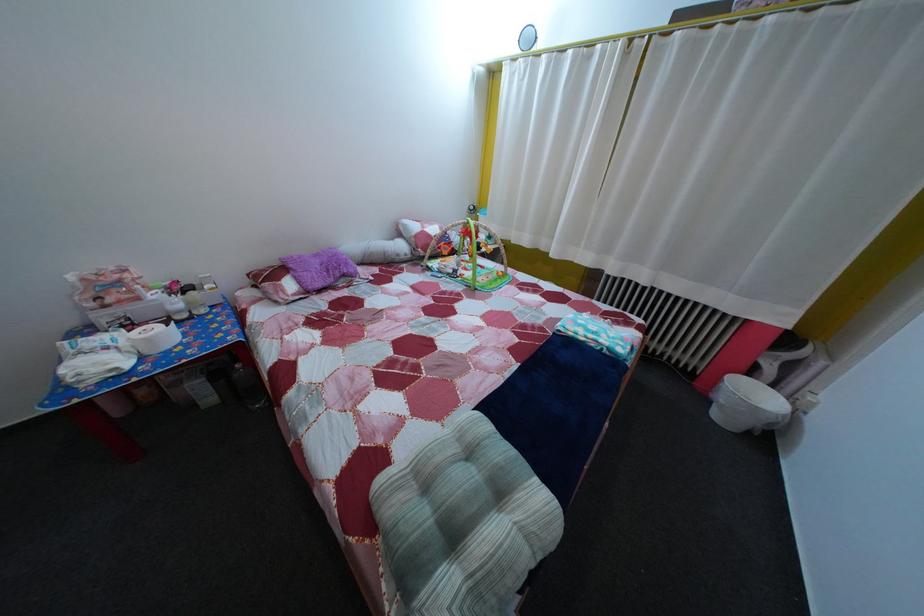
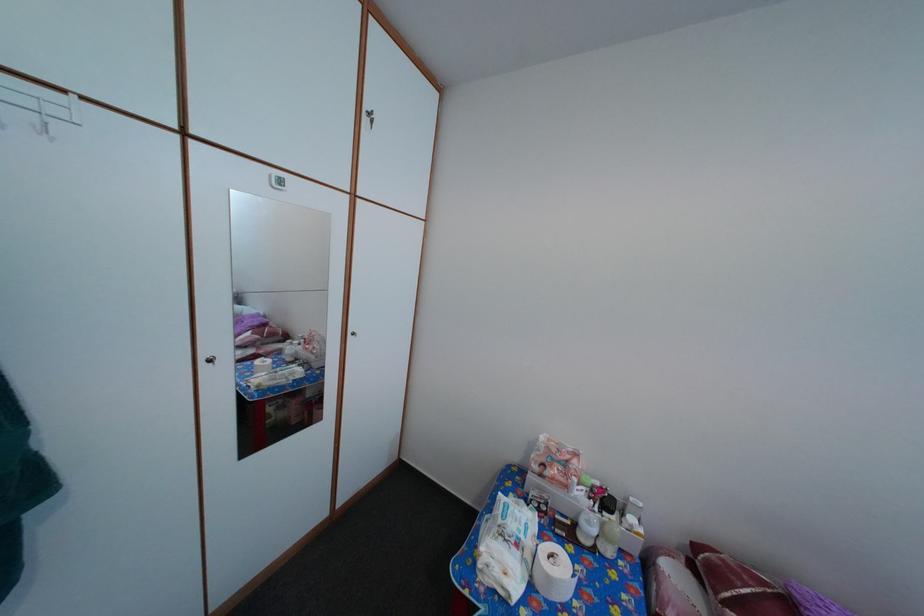
Find the pixel in the second image that matches the point at 259,283 in the first image.

(704, 554)